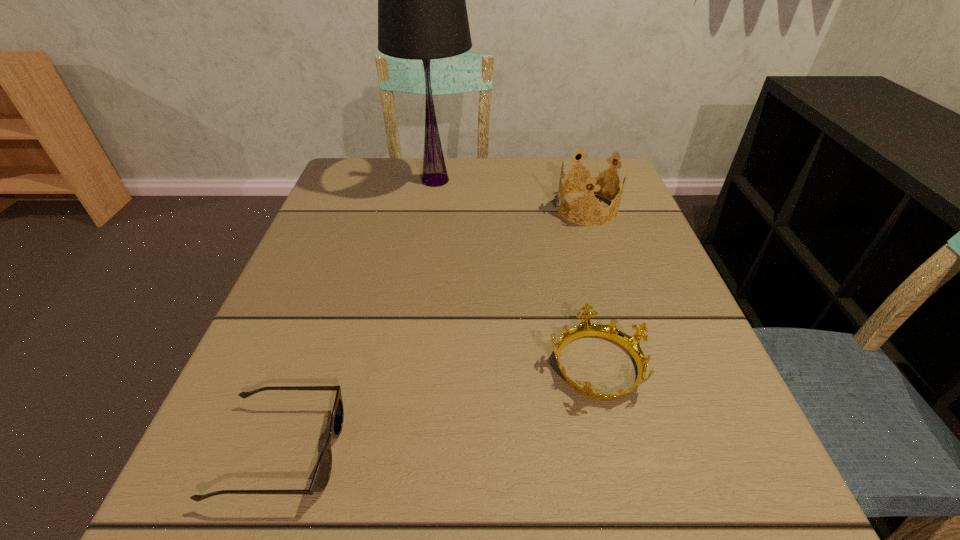
The width and height of the screenshot is (960, 540). Identify the location of the tallest object. coord(422,15).

The image size is (960, 540). I want to click on the second tallest object, so (592, 179).

Identify the location of the farther crown. Image resolution: width=960 pixels, height=540 pixels. (592, 179).

You are a GUI agent. You are given a task and a screenshot of the screen. Output one action in this format:
    pyautogui.click(x=<x>, y=<y>)
    Task: Click on the third tallest object
    The height and width of the screenshot is (540, 960).
    Given the screenshot: What is the action you would take?
    pyautogui.click(x=586, y=328)

Locate an element on the screen. This screenshot has height=540, width=960. the nearer crown is located at coordinates (586, 328).

Find the location of a particular element. sunglasses is located at coordinates (321, 477).

At what (x,y) coordinates should I click in order to perform the action: click on blank space located on the front-facing side of the lampshade. Please return your answer as a coordinate pair (x, y). The height and width of the screenshot is (540, 960). Looking at the image, I should click on (510, 180).

Image resolution: width=960 pixels, height=540 pixels. Find the location of `vacant space situated on the front of the second tallest object`. vacant space situated on the front of the second tallest object is located at coordinates (635, 355).

Identify the location of free space located on the back of the nearer crown. The width and height of the screenshot is (960, 540). (557, 200).

The height and width of the screenshot is (540, 960). In order to click on free point located on the front lenses of the sunglasses in this screenshot , I will do `click(467, 451)`.